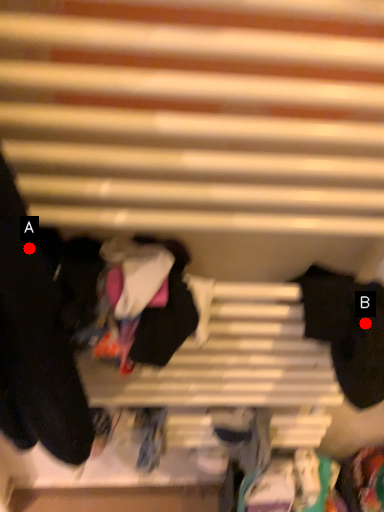
Question: Two points are circled on the image, labeled by A and B beside each circle. Which point is closer to the camera?

Choices:
 (A) A is closer
 (B) B is closer

Answer: (A)